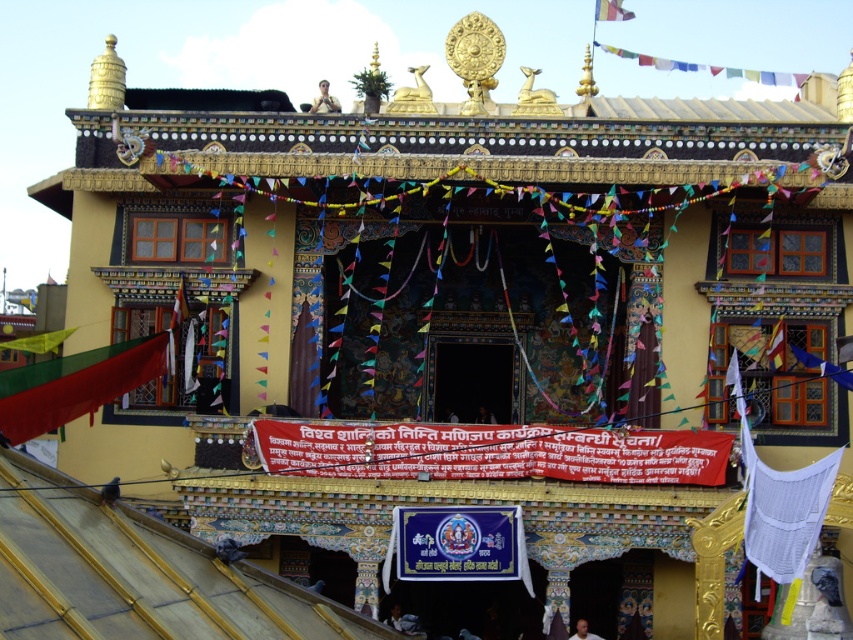
Question: Does matte gold statue at upper center appear over smooth skin face at center?

Choices:
 (A) yes
 (B) no

Answer: (A)

Question: In this image, where is matte gold statue at upper center located relative to smooth skin face at center?

Choices:
 (A) right
 (B) left

Answer: (B)

Question: Does matte gold statue at upper center have a larger size compared to smooth skin face at center?

Choices:
 (A) no
 (B) yes

Answer: (B)